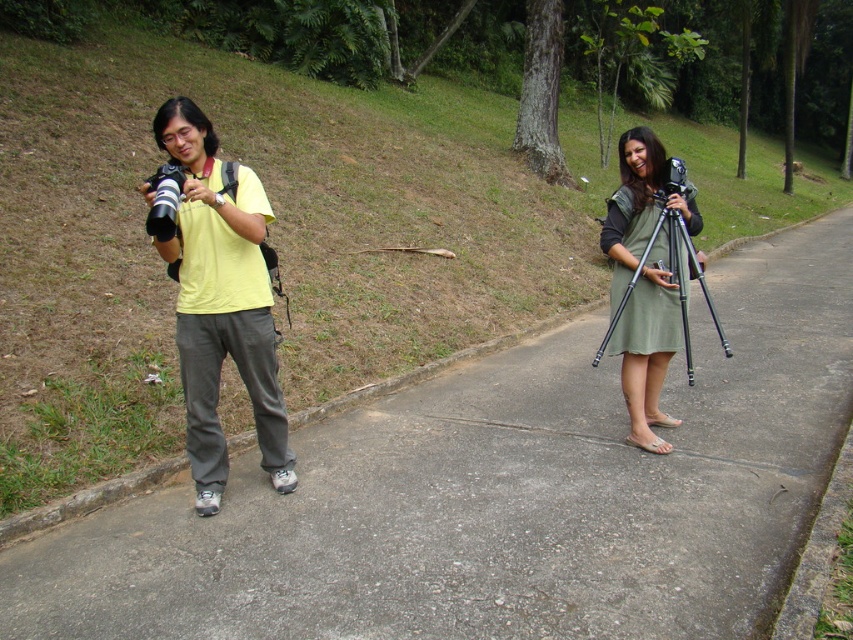
You are a photographer trying to set up your equipment on the gray concrete pavement at center. You have a black matte tripod at right that you need to place. Considering the size of the pavement, will the tripod fit comfortably without overhanging the edges?

The gray concrete pavement at center has a larger size compared to the black matte tripod at right, so the tripod will fit comfortably without overhanging the edges.

You are a photographer trying to set up your equipment. You notice the yellow matte shirt at left and the black matte tripod at right. Which object is closer to you according to the scene?

The yellow matte shirt at left is closer to you because it is in front of the black matte tripod at right.

What is located at the coordinates point (503,493) in the image?

The point (503,493) corresponds to gray concrete pavement at center.